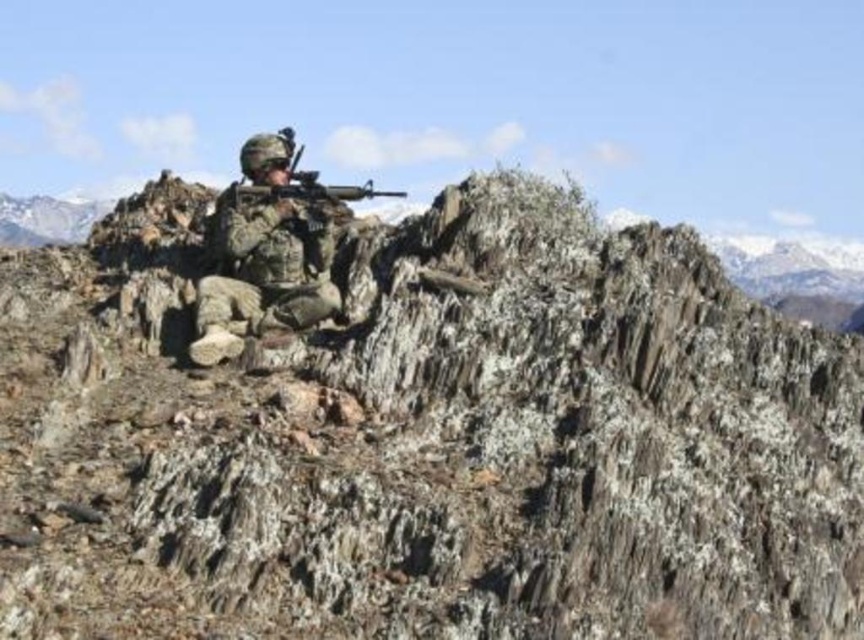
You are a soldier in a mountainous area. You have to determine whether your matte black rifle at center can be placed vertically on the rocky cliff at center without exceeding its height. Can it?

The rocky cliff at center is shorter than the matte black rifle at center. Therefore, placing the matte black rifle at center vertically on the rocky cliff at center would cause it to exceed the cliff height.

You are a drone operator controlling a drone that needs to fly from point A to point B. The coordinates for point A are point (98,572) and point B are point (239,198). Considering the soldier is positioned on a rocky outcrop, will the drone have a clear path from point A to point B without passing over the soldier?

Point (98,572) is in front of point (239,198), so the drone will have a clear path from point A to point B without passing over the soldier.

You are a military planner assessing the soldier in the image. You need to ensure that the soldier can quickly access their rifle during an emergency. Given that the standard safe handling distance for a rifle in combat is 2 meters, is the current distance between the camouflage fabric uniform at center and the matte black rifle at center within the recommended safety range?

The distance between the camouflage fabric uniform at center and the matte black rifle at center is 2.44 meters, which exceeds the standard safe handling distance of 2 meters. Therefore, the current positioning may not allow for quick access during an emergency.